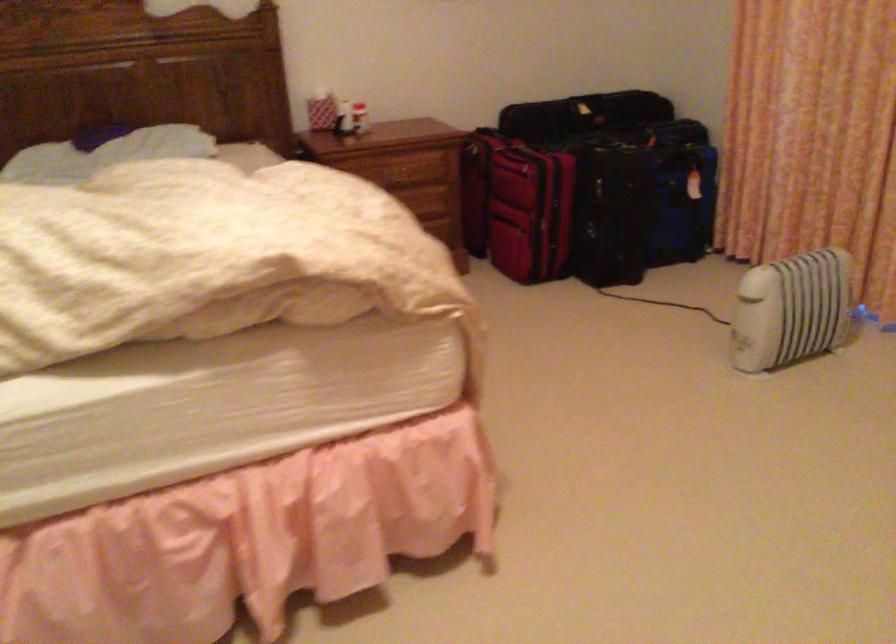
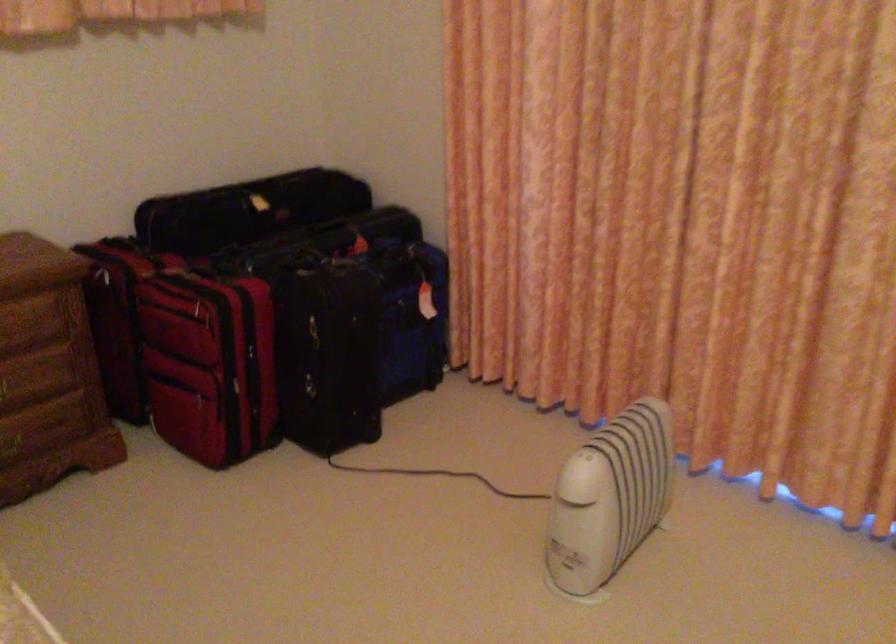
The point at (521, 162) is marked in the first image. Where is the corresponding point in the second image?

(202, 305)